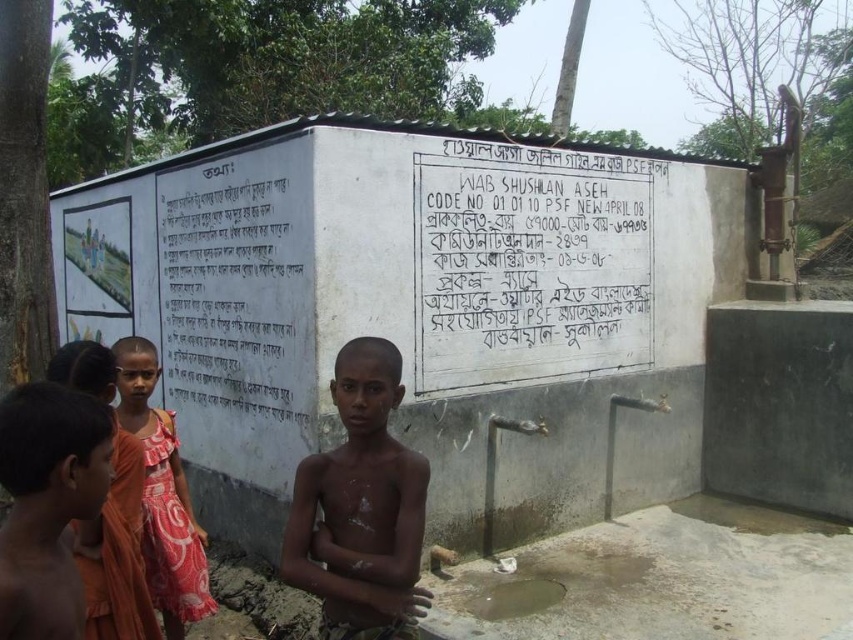
Which of these two, brown skin boy at center or orange fabric dress at lower left, stands shorter?

orange fabric dress at lower left is shorter.

Is point (355, 456) closer to viewer compared to point (93, 342)?

Yes, it is.

At what (x,y) coordinates should I click in order to perform the action: click on brown skin boy at center. Please return your answer as a coordinate pair (x, y). This screenshot has height=640, width=853. Looking at the image, I should click on (361, 508).

Who is more forward, [28,616] or [90,346]?

Point [28,616] is more forward.

What do you see at coordinates (47, 504) in the screenshot? The height and width of the screenshot is (640, 853). I see `brown skin boy at lower left` at bounding box center [47, 504].

Does point (1, 404) come farther from viewer compared to point (79, 524)?

No, it is in front of (79, 524).

The image size is (853, 640). I want to click on brown skin boy at lower left, so click(47, 504).

Is the position of white painted board at center less distant than that of orange fabric dress at lower left?

No, it is behind orange fabric dress at lower left.

What do you see at coordinates (529, 262) in the screenshot?
I see `white painted board at center` at bounding box center [529, 262].

Identify the location of white painted board at center. This screenshot has height=640, width=853. (529, 262).